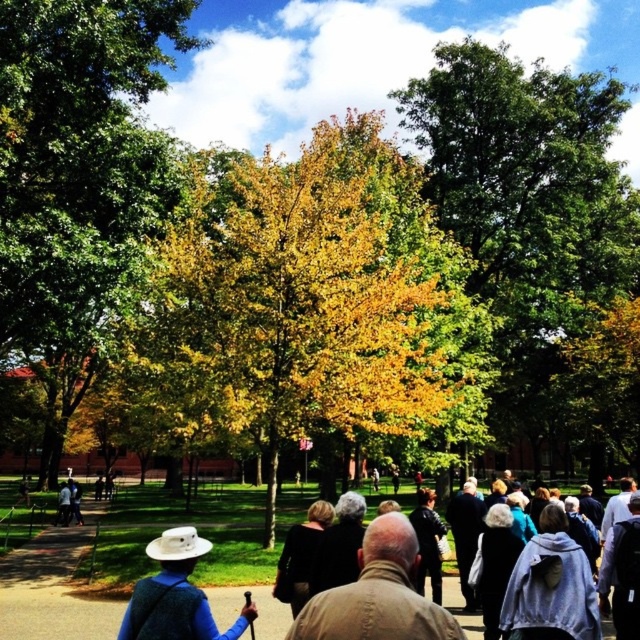
You are standing in the park and see the yellow leafy tree at center and the black matte jacket at center. Which object would appear bigger to someone looking at the scene?

The yellow leafy tree at center is larger in size than the black matte jacket at center, so it would appear bigger to someone looking at the scene.

You are standing at the point marked by the coordinates point (77, 163). What is the nearest object to you in the scene?

The nearest object to you at point (77, 163) is the yellow green leaves at center, as the coordinates provided correspond to that location.